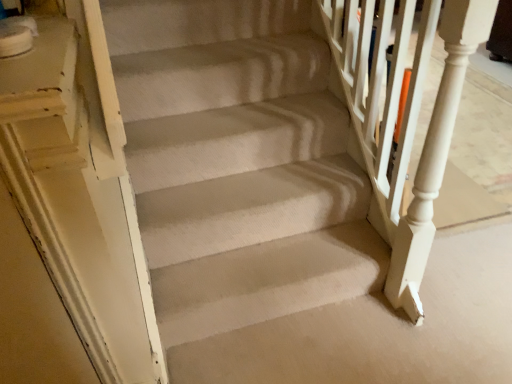
Image resolution: width=512 pixels, height=384 pixels. I want to click on blank space situated above beige carpeted stairs at center (from a real-world perspective), so click(x=289, y=263).